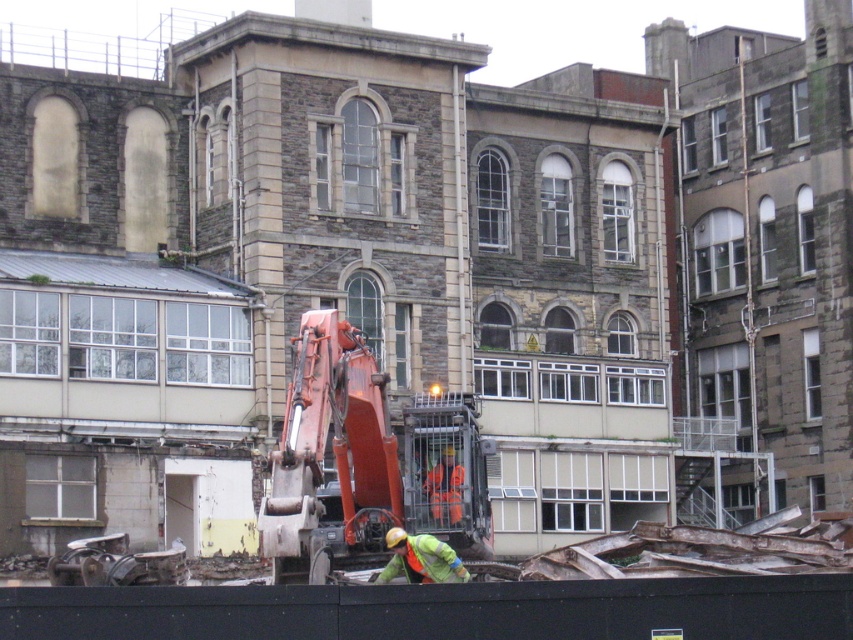
Question: Estimate the real-world distances between objects in this image. Which object is farther from the green reflective jacket at center?

Choices:
 (A) orange metallic excavator at center
 (B) orange reflective safety vest at center

Answer: (B)

Question: From the image, what is the correct spatial relationship of green reflective jacket at center in relation to orange reflective safety vest at center?

Choices:
 (A) below
 (B) above

Answer: (A)

Question: Which point is closer to the camera taking this photo?

Choices:
 (A) (387, 577)
 (B) (457, 480)
 (C) (444, 504)

Answer: (A)

Question: Does green reflective jacket at center appear over orange reflective safety vest at center?

Choices:
 (A) yes
 (B) no

Answer: (B)

Question: Can you confirm if green reflective jacket at center is positioned above orange reflective safety vest at center?

Choices:
 (A) no
 (B) yes

Answer: (A)

Question: Which object is closer to the camera taking this photo?

Choices:
 (A) green reflective jacket at center
 (B) orange metallic excavator at center
 (C) orange reflective safety vest at center

Answer: (A)